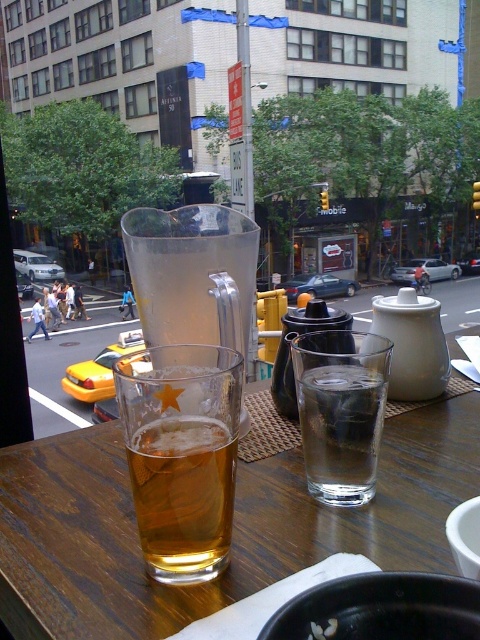
Which is below, clear glass beer at center or yellow matte taxi at lower left?

yellow matte taxi at lower left is below.

Is point (332, 483) positioned before point (137, 346)?

Yes, point (332, 483) is in front of point (137, 346).

You are a GUI agent. You are given a task and a screenshot of the screen. Output one action in this format:
    pyautogui.click(x=<x>, y=<y>)
    Task: Click on the clear glass beer at center
    The image size is (480, 640).
    Given the screenshot: What is the action you would take?
    (340, 410)

Which is more to the right, wooden table at center or yellow matte taxi at lower left?

From the viewer's perspective, wooden table at center appears more on the right side.

Is point (7, 588) closer to viewer compared to point (92, 374)?

Yes, point (7, 588) is closer to viewer.

Locate an element on the screen. This screenshot has width=480, height=640. wooden table at center is located at coordinates (233, 525).

Can you confirm if clear glass beer at center is smaller than white creamy food at center?

Actually, clear glass beer at center might be larger than white creamy food at center.

Does clear glass beer at center appear under white creamy food at center?

No.

Which is in front, point (303, 396) or point (313, 632)?

Point (313, 632)

Locate an element on the screen. The height and width of the screenshot is (640, 480). clear glass beer at center is located at coordinates (340, 410).